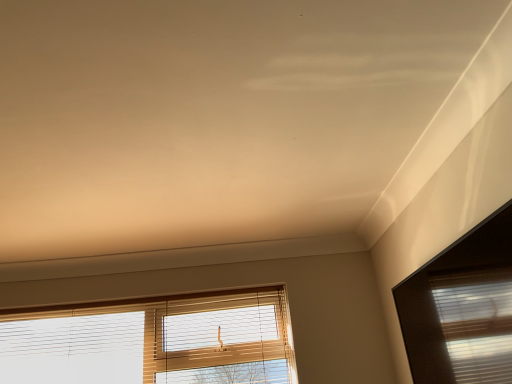
Question: Does wooden blinds at lower center, the 1th window in the back-to-front sequence, appear on the left side of matte glass window at upper right, the second window from the left?

Choices:
 (A) no
 (B) yes

Answer: (B)

Question: From the image's perspective, is wooden blinds at lower center, which is the second window in right-to-left order, below matte glass window at upper right, acting as the first window starting from the right?

Choices:
 (A) no
 (B) yes

Answer: (B)

Question: Does wooden blinds at lower center, which is the second window in right-to-left order, turn towards matte glass window at upper right, acting as the first window starting from the right?

Choices:
 (A) yes
 (B) no

Answer: (A)

Question: Can you confirm if wooden blinds at lower center, the 1th window in the back-to-front sequence, is wider than matte glass window at upper right, the second window from the left?

Choices:
 (A) no
 (B) yes

Answer: (B)

Question: Is wooden blinds at lower center, the first window viewed from the left, next to matte glass window at upper right, acting as the first window starting from the right?

Choices:
 (A) yes
 (B) no

Answer: (B)

Question: From a real-world perspective, is wooden blinds at lower center, the 1th window in the back-to-front sequence, under matte glass window at upper right, the second window from the left?

Choices:
 (A) yes
 (B) no

Answer: (B)

Question: Can you confirm if matte glass window at upper right, the second window from the left, is wider than wooden blinds at lower center, which is the second window in right-to-left order?

Choices:
 (A) yes
 (B) no

Answer: (B)

Question: Is matte glass window at upper right, acting as the first window starting from the right, smaller than wooden blinds at lower center, the 1th window in the back-to-front sequence?

Choices:
 (A) no
 (B) yes

Answer: (B)

Question: Does matte glass window at upper right, the second window from the left, have a lesser width compared to wooden blinds at lower center, which is the second window in right-to-left order?

Choices:
 (A) no
 (B) yes

Answer: (B)

Question: Does matte glass window at upper right, the first window in the front-to-back sequence, turn towards wooden blinds at lower center, arranged as the second window when viewed from the front?

Choices:
 (A) yes
 (B) no

Answer: (A)

Question: Does matte glass window at upper right, acting as the first window starting from the right, lie behind wooden blinds at lower center, the 1th window in the back-to-front sequence?

Choices:
 (A) no
 (B) yes

Answer: (A)

Question: Can you confirm if matte glass window at upper right, the first window in the front-to-back sequence, is positioned to the left of wooden blinds at lower center, the 1th window in the back-to-front sequence?

Choices:
 (A) no
 (B) yes

Answer: (A)

Question: Considering the positions of matte glass window at upper right, the second window from the left, and wooden blinds at lower center, the 1th window in the back-to-front sequence, in the image, is matte glass window at upper right, the second window from the left, bigger or smaller than wooden blinds at lower center, the 1th window in the back-to-front sequence,?

Choices:
 (A) small
 (B) big

Answer: (A)